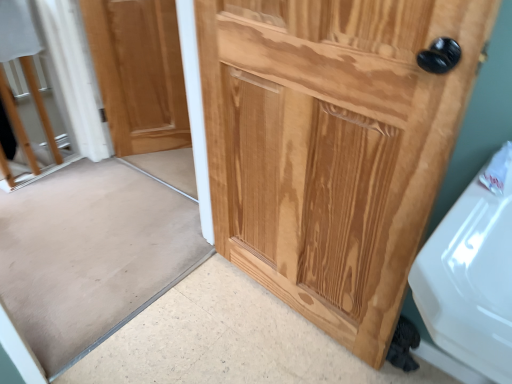
What is the approximate height of natural wood screen door at center?

1.09 meters.

At what (x,y) coordinates should I click in order to perform the action: click on natural wood screen door at center. Please return your answer as a coordinate pair (x, y). Looking at the image, I should click on (95, 250).

Which is behind, natural wood screen door at center or natural wood door at upper left, the second door viewed from the right?

natural wood door at upper left, the second door viewed from the right, is behind.

Does point (40, 329) come farther from viewer compared to point (118, 14)?

No, (40, 329) is in front of (118, 14).

Is natural wood screen door at center located outside natural wood door at upper left, which is counted as the second door, starting from the front?

Indeed, natural wood screen door at center is completely outside natural wood door at upper left, which is counted as the second door, starting from the front.

Who is bigger, natural wood screen door at center or natural wood door at upper left, which is counted as the second door, starting from the front?

Bigger between the two is natural wood screen door at center.

Considering the relative sizes of natural wood screen door at center and natural wood door at right, acting as the first door starting from the right, in the image provided, is natural wood screen door at center smaller than natural wood door at right, acting as the first door starting from the right,?

Indeed, natural wood screen door at center has a smaller size compared to natural wood door at right, acting as the first door starting from the right.

Is natural wood screen door at center not within natural wood door at right, acting as the first door starting from the right?

Yes, natural wood screen door at center is located beyond the bounds of natural wood door at right, acting as the first door starting from the right.

You are a GUI agent. You are given a task and a screenshot of the screen. Output one action in this format:
    pyautogui.click(x=<x>, y=<y>)
    Task: Click on the screen door behind the natural wood door at right, acting as the first door starting from the right
    
    Given the screenshot: What is the action you would take?
    pyautogui.click(x=95, y=250)

Does natural wood door at right, positioned as the 2th door in left-to-right order, have a lesser width compared to natural wood screen door at center?

Incorrect, the width of natural wood door at right, positioned as the 2th door in left-to-right order, is not less than that of natural wood screen door at center.

Is point (334, 147) positioned before point (177, 188)?

Yes, it is in front of point (177, 188).

Where is `screen door located behind the natural wood door at right, acting as the first door starting from the right`? The height and width of the screenshot is (384, 512). screen door located behind the natural wood door at right, acting as the first door starting from the right is located at coordinates (95, 250).

Is natural wood door at right, which is the second door from back to front, aimed at natural wood screen door at center?

Yes, natural wood door at right, which is the second door from back to front, is oriented towards natural wood screen door at center.

In terms of size, does natural wood door at right, positioned as the 2th door in left-to-right order, appear bigger or smaller than natural wood door at upper left, which is counted as the 1th door, starting from the left?

natural wood door at right, positioned as the 2th door in left-to-right order, is bigger than natural wood door at upper left, which is counted as the 1th door, starting from the left.

Is natural wood door at right, acting as the first door starting from the right, at the right side of natural wood door at upper left, arranged as the first door when viewed from the back?

Yes.

Identify the location of door above the natural wood door at upper left, arranged as the first door when viewed from the back (from a real-world perspective). 332,146.

Which is correct: natural wood door at right, acting as the first door starting from the right, is inside natural wood door at upper left, which is counted as the second door, starting from the front, or outside of it?

natural wood door at right, acting as the first door starting from the right, is spatially situated outside natural wood door at upper left, which is counted as the second door, starting from the front.

Looking at their sizes, would you say natural wood door at upper left, arranged as the first door when viewed from the back, is wider or thinner than natural wood screen door at center?

Considering their sizes, natural wood door at upper left, arranged as the first door when viewed from the back, looks slimmer than natural wood screen door at center.

Is natural wood door at upper left, the second door viewed from the right, facing away from natural wood screen door at center?

natural wood door at upper left, the second door viewed from the right, is not turned away from natural wood screen door at center.

From a real-world perspective, which is physically below, natural wood door at upper left, the second door viewed from the right, or natural wood screen door at center?

From a 3D spatial view, natural wood door at upper left, the second door viewed from the right, is below.

Can natural wood screen door at center be found inside natural wood door at upper left, the second door viewed from the right?

No, natural wood screen door at center is not surrounded by natural wood door at upper left, the second door viewed from the right.

What's the angular difference between natural wood door at upper left, the second door viewed from the right, and natural wood door at right, acting as the first door starting from the right,'s facing directions?

59.7 degrees.

From a real-world perspective, is natural wood door at upper left, which is counted as the second door, starting from the front, positioned under natural wood door at right, acting as the first door starting from the right, based on gravity?

Indeed, from a real-world perspective, natural wood door at upper left, which is counted as the second door, starting from the front, is positioned beneath natural wood door at right, acting as the first door starting from the right.

Would you consider natural wood door at upper left, the second door viewed from the right, to be distant from natural wood door at right, positioned as the 2th door in left-to-right order?

Yes, natural wood door at upper left, the second door viewed from the right, and natural wood door at right, positioned as the 2th door in left-to-right order, are quite far apart.

Is natural wood door at upper left, which is counted as the 1th door, starting from the left, at the left side of natural wood door at right, acting as the first door starting from the right?

Indeed, natural wood door at upper left, which is counted as the 1th door, starting from the left, is positioned on the left side of natural wood door at right, acting as the first door starting from the right.

Where is `door to the left of natural wood screen door at center`? This screenshot has height=384, width=512. door to the left of natural wood screen door at center is located at coordinates (139, 73).

The height and width of the screenshot is (384, 512). I want to click on screen door located underneath the natural wood door at right, acting as the first door starting from the right (from a real-world perspective), so click(x=95, y=250).

Estimate the real-world distances between objects in this image. Which object is closer to natural wood screen door at center, natural wood door at upper left, the second door viewed from the right, or natural wood door at right, positioned as the 2th door in left-to-right order?

Based on the image, natural wood door at upper left, the second door viewed from the right, appears to be nearer to natural wood screen door at center.

Considering their positions, is natural wood screen door at center positioned closer to natural wood door at right, acting as the first door starting from the right, than natural wood door at upper left, the second door viewed from the right?

natural wood screen door at center lies closer to natural wood door at right, acting as the first door starting from the right, than the other object.

From the image, which object appears to be nearer to natural wood screen door at center, natural wood door at right, which is the second door from back to front, or natural wood door at upper left, which is counted as the second door, starting from the front?

natural wood door at upper left, which is counted as the second door, starting from the front, is positioned closer to the anchor natural wood screen door at center.

Looking at the image, which one is located further to natural wood door at upper left, which is counted as the 1th door, starting from the left, natural wood door at right, which is the second door from back to front, or natural wood screen door at center?

Among the two, natural wood door at right, which is the second door from back to front, is located further to natural wood door at upper left, which is counted as the 1th door, starting from the left.

When comparing their distances from natural wood door at right, acting as the first door starting from the right, does natural wood door at upper left, the second door viewed from the right, or natural wood screen door at center seem closer?

Based on the image, natural wood screen door at center appears to be nearer to natural wood door at right, acting as the first door starting from the right.

Which object lies nearer to the anchor point natural wood door at upper left, which is counted as the second door, starting from the front, natural wood screen door at center or natural wood door at right, the 1th door from the front?

natural wood screen door at center is positioned closer to the anchor natural wood door at upper left, which is counted as the second door, starting from the front.

This screenshot has height=384, width=512. What are the coordinates of `screen door between natural wood door at right, the 1th door from the front, and natural wood door at upper left, which is counted as the 1th door, starting from the left, along the z-axis` in the screenshot? It's located at (95, 250).